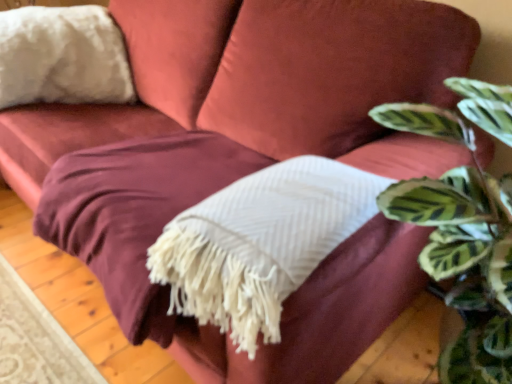
Question: Does white textured blanket at center have a greater width compared to green striped leaf at upper right?

Choices:
 (A) yes
 (B) no

Answer: (B)

Question: Is white textured blanket at center outside green striped leaf at upper right?

Choices:
 (A) no
 (B) yes

Answer: (B)

Question: From the image's perspective, does white textured blanket at center appear lower than green striped leaf at upper right?

Choices:
 (A) no
 (B) yes

Answer: (A)

Question: From the image's perspective, does white textured blanket at center appear higher than green striped leaf at upper right?

Choices:
 (A) yes
 (B) no

Answer: (A)

Question: Is white textured blanket at center not near green striped leaf at upper right?

Choices:
 (A) yes
 (B) no

Answer: (B)

Question: Is white textured blanket at center bigger than green striped leaf at upper right?

Choices:
 (A) no
 (B) yes

Answer: (A)

Question: Does white fluffy pillow at upper left have a lesser height compared to white textured blanket at center?

Choices:
 (A) no
 (B) yes

Answer: (A)

Question: Does white fluffy pillow at upper left lie behind white textured blanket at center?

Choices:
 (A) yes
 (B) no

Answer: (A)

Question: Can you confirm if white fluffy pillow at upper left is taller than white textured blanket at center?

Choices:
 (A) no
 (B) yes

Answer: (B)

Question: Considering the relative positions of white fluffy pillow at upper left and white textured blanket at center in the image provided, is white fluffy pillow at upper left to the left of white textured blanket at center from the viewer's perspective?

Choices:
 (A) yes
 (B) no

Answer: (A)

Question: Is white fluffy pillow at upper left aimed at white textured blanket at center?

Choices:
 (A) yes
 (B) no

Answer: (A)

Question: Is white fluffy pillow at upper left located outside white textured blanket at center?

Choices:
 (A) yes
 (B) no

Answer: (A)

Question: Considering the relative sizes of green striped leaf at upper right and white fluffy pillow at upper left in the image provided, is green striped leaf at upper right smaller than white fluffy pillow at upper left?

Choices:
 (A) no
 (B) yes

Answer: (A)